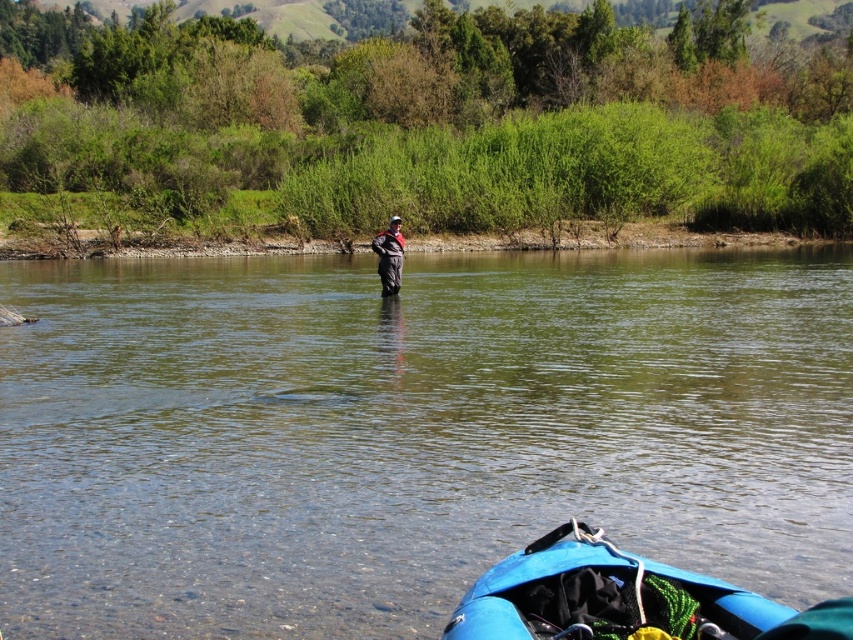
You are a hiker who wants to cross the river using the kayak. The kayak is located at the center. You see the clear water at center and dark gray waterproof jacket at center. Which object is positioned to the right of the other?

The clear water at center is to the right of dark gray waterproof jacket at center, so the clear water at center is positioned to the right of the dark gray waterproof jacket at center.

You are planning to cross from the blue rubber canoe at lower center to the clear water at center. Given that your equipment can only handle a maximum distance of 7 meters, will you be able to make the crossing?

The distance between the clear water at center and the blue rubber canoe at lower center is 7.28 meters, which exceeds the equipment limit of 7 meters. Therefore, you cannot safely make the crossing.